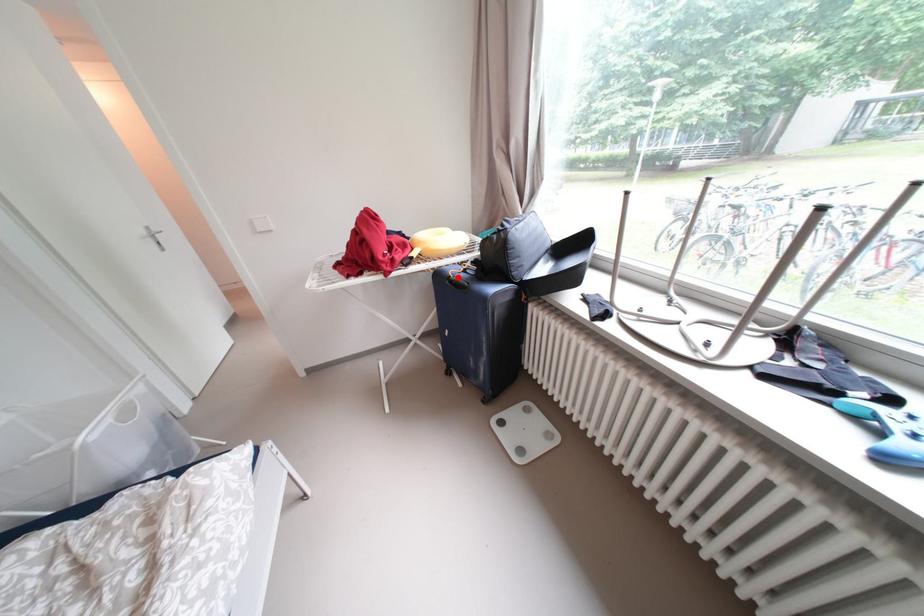
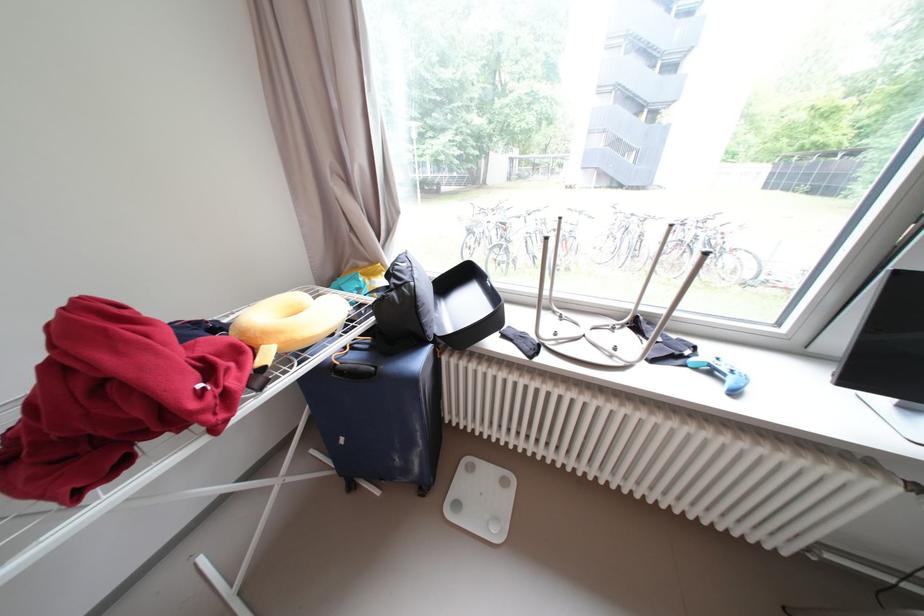
In the second image, find the point that corresponds to the highlighted location in the first image.

(344, 366)